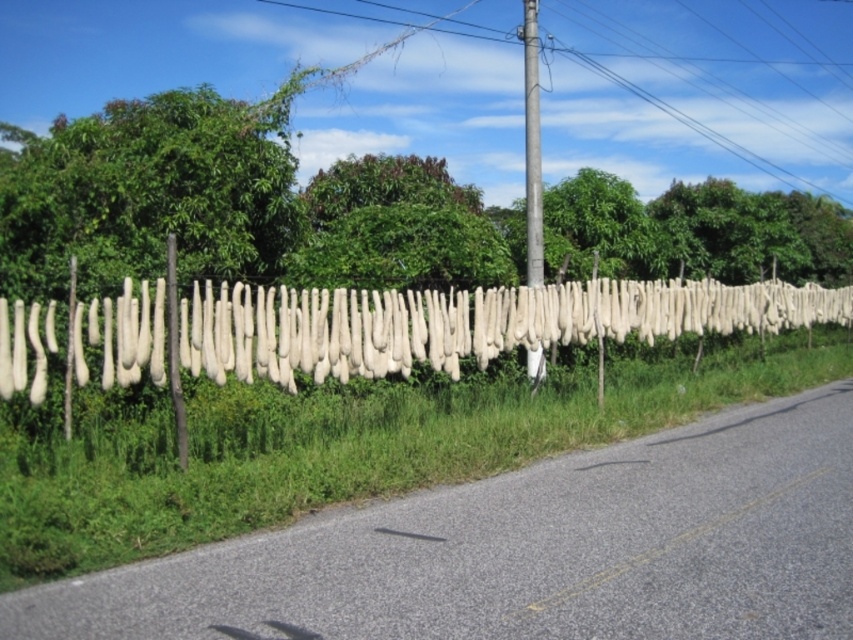
You are a delivery driver approaching the road with the white fabric at center and the metallic gray pole at center. You need to know if your truck, which is 2 meters tall, can pass under them without hitting anything. Can you determine which object you need to worry about?

The white fabric at center has a lesser height compared to metallic gray pole at center. Since the truck is 2 meters tall, you need to check the height of the white fabric at center because it is shorter and might be lower than the truck.

You are a delivery driver approaching the road. You see a white fabric at center and a yellow asphalt road at center. Which object is higher in position?

The white fabric at center is higher in position than the yellow asphalt road at center because it is above it.